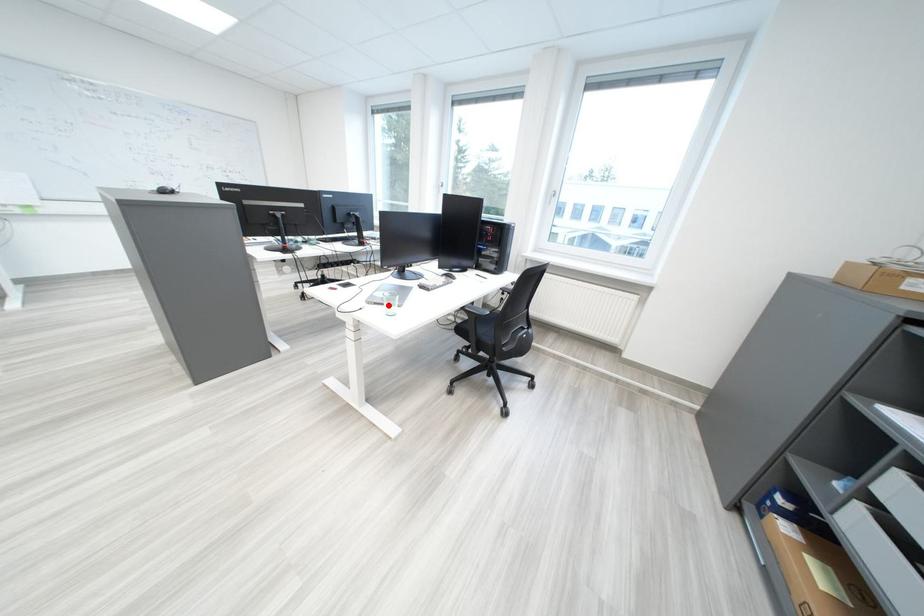
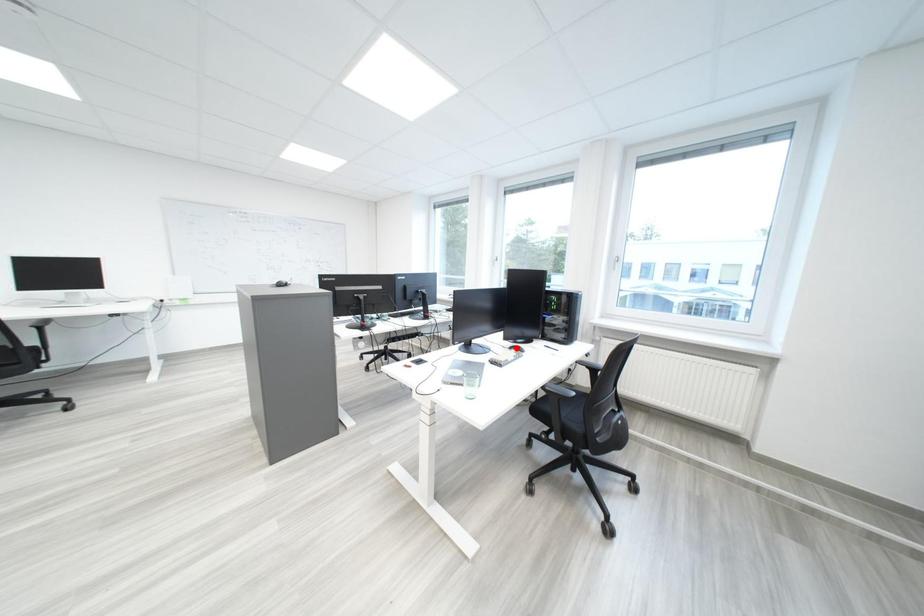
I am providing you with two images of the same scene from different viewpoints. A red point is marked on the first image and another point is marked on the second image. Is the marked point in image1 the same physical position as the marked point in image2?

No